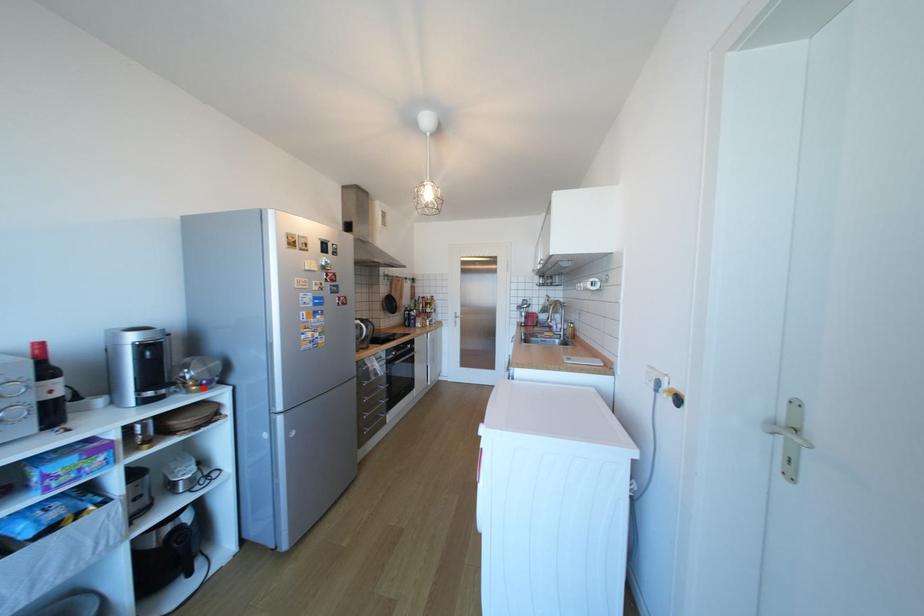
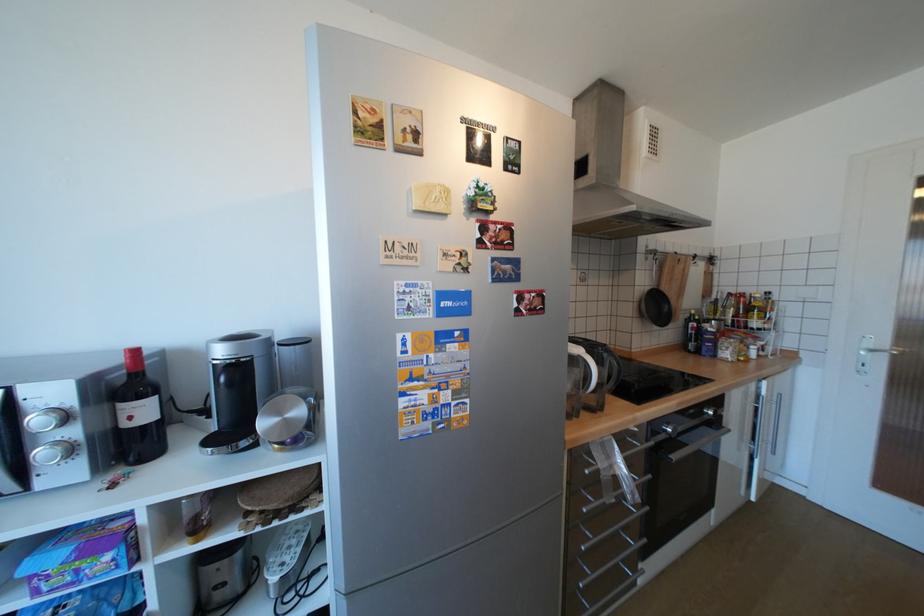
Find the pixel in the second image that matches the highlighted location in the first image.

(286, 446)